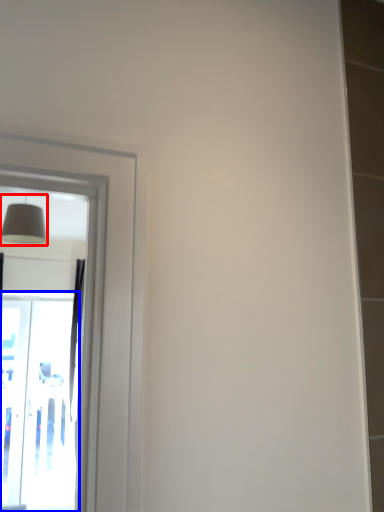
Question: Which object appears closest to the camera in this image, lamp (highlighted by a red box) or screen door (highlighted by a blue box)?

Choices:
 (A) lamp
 (B) screen door

Answer: (A)